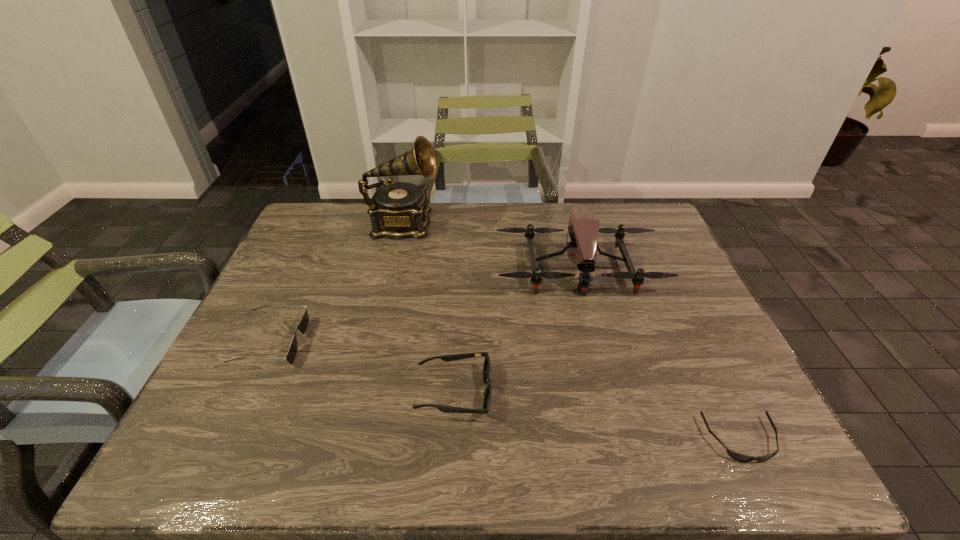
The image size is (960, 540). What are the coordinates of `vacant area at the left edge` in the screenshot? It's located at (272, 347).

The height and width of the screenshot is (540, 960). In order to click on vacant point at the right edge in this screenshot , I will do `click(710, 426)`.

Locate an element on the screen. vacant space at the far left corner is located at coordinates (326, 242).

Where is `free space at the near left corner of the desktop`? Image resolution: width=960 pixels, height=540 pixels. free space at the near left corner of the desktop is located at coordinates (218, 435).

The image size is (960, 540). Find the location of `free area in between the phonograph record and the leftmost object`. free area in between the phonograph record and the leftmost object is located at coordinates (338, 284).

At what (x,y) coordinates should I click in order to perform the action: click on free space between the second sunglasses from left to right and the tallest object. Please return your answer as a coordinate pair (x, y). The image size is (960, 540). Looking at the image, I should click on (429, 308).

Find the location of `free space between the leftmost object and the second sunglasses from left to right`. free space between the leftmost object and the second sunglasses from left to right is located at coordinates coord(363,367).

In order to click on free space between the phonograph record and the shortest object in this screenshot , I will do `click(572, 332)`.

This screenshot has width=960, height=540. Find the location of `vacant area that lies between the leftmost object and the tallest object`. vacant area that lies between the leftmost object and the tallest object is located at coordinates (338, 284).

In order to click on vacant point located between the fourth shortest object and the rightmost sunglasses in this screenshot , I will do `click(660, 354)`.